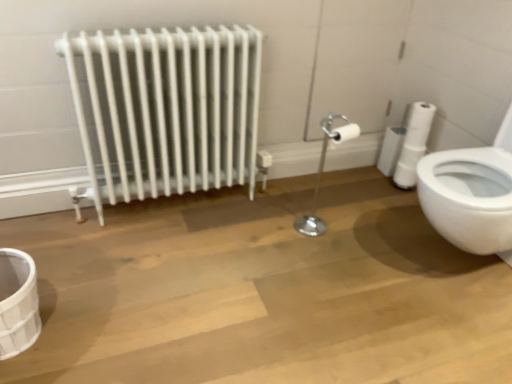
What is the approximate width of white matte toilet paper at right?

The width of white matte toilet paper at right is 4.88 inches.

Where is `white matte toilet paper at right`? white matte toilet paper at right is located at coordinates (419, 126).

Describe the element at coordinates (419, 126) in the screenshot. The image size is (512, 384). I see `white matte toilet paper at right` at that location.

What do you see at coordinates (166, 110) in the screenshot? Image resolution: width=512 pixels, height=384 pixels. I see `white metallic radiator at left` at bounding box center [166, 110].

Where is `white metallic radiator at left`? Image resolution: width=512 pixels, height=384 pixels. white metallic radiator at left is located at coordinates (166, 110).

Where is `white matte toilet paper at right`? white matte toilet paper at right is located at coordinates (419, 126).

Which object is positioned more to the right, white metallic radiator at left or white matte toilet paper at right?

white matte toilet paper at right is more to the right.

Is white metallic radiator at left in front of or behind white matte toilet paper at right in the image?

white metallic radiator at left is in front of white matte toilet paper at right.

Is point (213, 112) behind point (416, 141)?

No.

From the image's perspective, relative to white matte toilet paper at right, is white metallic radiator at left above or below?

From the image's perspective, white metallic radiator at left appears below white matte toilet paper at right.

From a real-world perspective, which is physically below, white metallic radiator at left or white matte toilet paper at right?

white matte toilet paper at right, from a real-world perspective.

Considering the relative sizes of white metallic radiator at left and white matte toilet paper at right in the image provided, is white metallic radiator at left wider than white matte toilet paper at right?

Correct, the width of white metallic radiator at left exceeds that of white matte toilet paper at right.

Does white metallic radiator at left have a lesser height compared to white matte toilet paper at right?

No.

In the scene shown: Does white metallic radiator at left have a larger size compared to white matte toilet paper at right?

Yes, white metallic radiator at left is bigger than white matte toilet paper at right.

Based on the photo, is white metallic radiator at left inside the boundaries of white matte toilet paper at right, or outside?

white metallic radiator at left cannot be found inside white matte toilet paper at right.

Would you say white metallic radiator at left is a long distance from white matte toilet paper at right?

Indeed, white metallic radiator at left is not near white matte toilet paper at right.

Is white metallic radiator at left facing away from white matte toilet paper at right?

No, white metallic radiator at left is not facing the opposite direction of white matte toilet paper at right.

In the scene shown: Can you tell me how much white metallic radiator at left and white matte toilet paper at right differ in facing direction?

The angular difference between white metallic radiator at left and white matte toilet paper at right is 88.7 degrees.

This screenshot has width=512, height=384. What are the coordinates of `radiator that is in front of the white matte toilet paper at right` in the screenshot? It's located at (166, 110).

Does white matte toilet paper at right appear on the left side of white metallic radiator at left?

No.

Is white matte toilet paper at right in front of or behind white metallic radiator at left in the image?

In the image, white matte toilet paper at right appears behind white metallic radiator at left.

Between point (417, 109) and point (141, 63), which one is positioned behind?

The point (417, 109) is farther from the camera.

From the image's perspective, relative to white metallic radiator at left, is white matte toilet paper at right above or below?

white matte toilet paper at right is situated higher than white metallic radiator at left in the image.

From a real-world perspective, is white matte toilet paper at right positioned above or below white metallic radiator at left?

white matte toilet paper at right is situated lower than white metallic radiator at left in the real world.

Does white matte toilet paper at right have a greater width compared to white metallic radiator at left?

No, white matte toilet paper at right is not wider than white metallic radiator at left.

Is white matte toilet paper at right taller than white metallic radiator at left?

Incorrect, the height of white matte toilet paper at right is not larger of that of white metallic radiator at left.

Looking at the image, does white matte toilet paper at right seem bigger or smaller compared to white metallic radiator at left?

Considering their sizes, white matte toilet paper at right takes up less space than white metallic radiator at left.

Is white matte toilet paper at right completely or partially outside of white metallic radiator at left?

Absolutely, white matte toilet paper at right is external to white metallic radiator at left.

Does white matte toilet paper at right touch white metallic radiator at left?

No, white matte toilet paper at right is not touching white metallic radiator at left.

Could you tell me if white matte toilet paper at right is turned towards white metallic radiator at left?

Yes, white matte toilet paper at right is aimed at white metallic radiator at left.

Can you tell me how much white matte toilet paper at right and white metallic radiator at left differ in facing direction?

The facing directions of white matte toilet paper at right and white metallic radiator at left are 88.7 degrees apart.

Based on the photo, how far apart are white matte toilet paper at right and white metallic radiator at left?

white matte toilet paper at right and white metallic radiator at left are 1.15 meters apart from each other.

Find the location of a particular element. The image size is (512, 384). toilet paper behind the white metallic radiator at left is located at coordinates coord(419,126).

Locate an element on the screen. The height and width of the screenshot is (384, 512). radiator located below the white matte toilet paper at right (from the image's perspective) is located at coordinates (166, 110).

There is a white matte toilet paper at right. In order to click on radiator above it (from a real-world perspective) in this screenshot , I will do `click(166, 110)`.